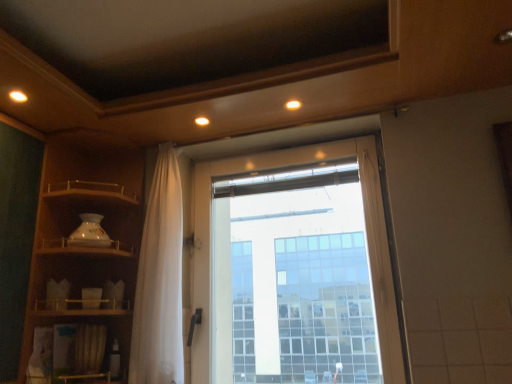
Question: From the image's perspective, does matte wood shelf at left appear lower than transparent glass window at center?

Choices:
 (A) no
 (B) yes

Answer: (A)

Question: Would you say transparent glass window at center is part of matte wood shelf at left's contents?

Choices:
 (A) yes
 (B) no

Answer: (B)

Question: Is matte wood shelf at left facing towards transparent glass window at center?

Choices:
 (A) no
 (B) yes

Answer: (B)

Question: Is matte wood shelf at left outside transparent glass window at center?

Choices:
 (A) yes
 (B) no

Answer: (A)

Question: From the image's perspective, does matte wood shelf at left appear higher than transparent glass window at center?

Choices:
 (A) yes
 (B) no

Answer: (A)

Question: In the image, is white sheer curtain at center on the left side or the right side of transparent glass window at center?

Choices:
 (A) right
 (B) left

Answer: (B)

Question: From a real-world perspective, is white sheer curtain at center physically located above or below transparent glass window at center?

Choices:
 (A) below
 (B) above

Answer: (B)

Question: Would you say white sheer curtain at center is inside or outside transparent glass window at center?

Choices:
 (A) outside
 (B) inside

Answer: (A)

Question: From the image's perspective, relative to transparent glass window at center, is white sheer curtain at center above or below?

Choices:
 (A) below
 (B) above

Answer: (B)

Question: Considering the positions of point (90, 319) and point (147, 329), is point (90, 319) closer or farther from the camera than point (147, 329)?

Choices:
 (A) closer
 (B) farther

Answer: (B)

Question: Based on their sizes in the image, would you say matte wood shelf at left is bigger or smaller than white sheer curtain at center?

Choices:
 (A) small
 (B) big

Answer: (B)

Question: From a real-world perspective, relative to white sheer curtain at center, is matte wood shelf at left vertically above or below?

Choices:
 (A) above
 (B) below

Answer: (A)

Question: Is matte wood shelf at left wider or thinner than white sheer curtain at center?

Choices:
 (A) thin
 (B) wide

Answer: (B)

Question: Would you say matte wood shelf at left is inside or outside transparent glass window at center?

Choices:
 (A) outside
 (B) inside

Answer: (A)

Question: Considering the positions of point (64, 317) and point (373, 193), is point (64, 317) closer or farther from the camera than point (373, 193)?

Choices:
 (A) farther
 (B) closer

Answer: (B)